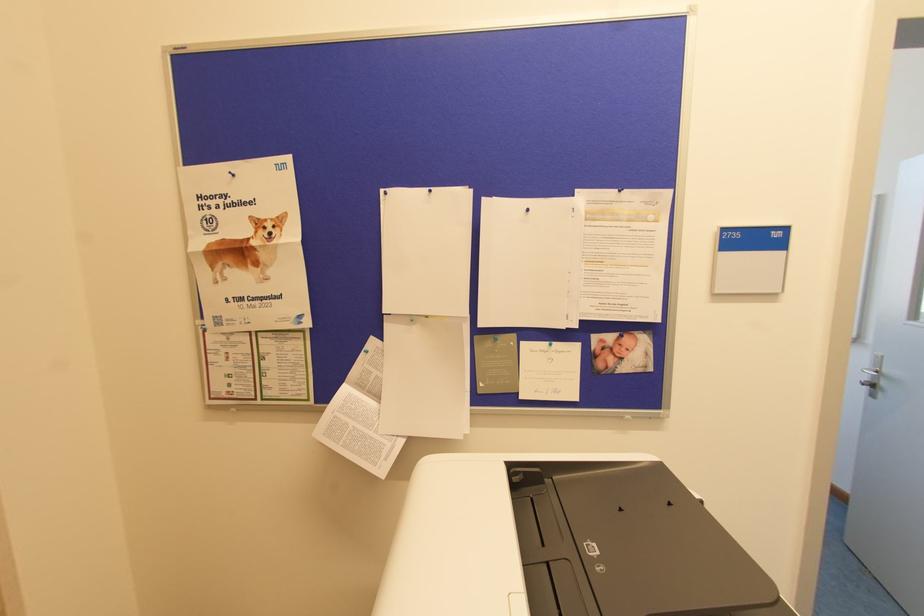
What do you see at coordinates (871, 376) in the screenshot? I see `a silver door handle` at bounding box center [871, 376].